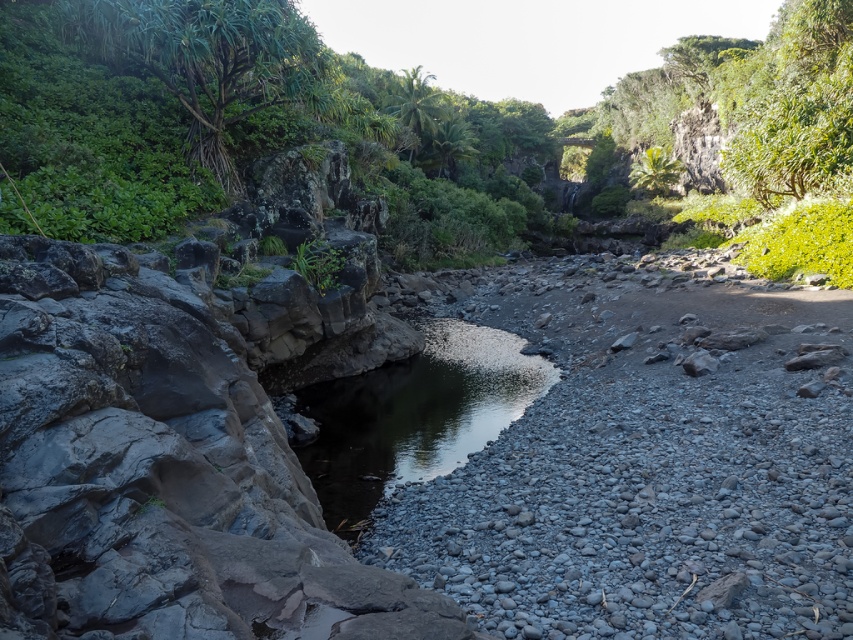
Between point (807, 180) and point (335, 499), which one is positioned behind?

The point (807, 180) is behind.

Is green leafy shrubs at center further to the viewer compared to clear water at center?

Yes, it is behind clear water at center.

Where is `green leafy shrubs at center`? This screenshot has height=640, width=853. green leafy shrubs at center is located at coordinates (567, 129).